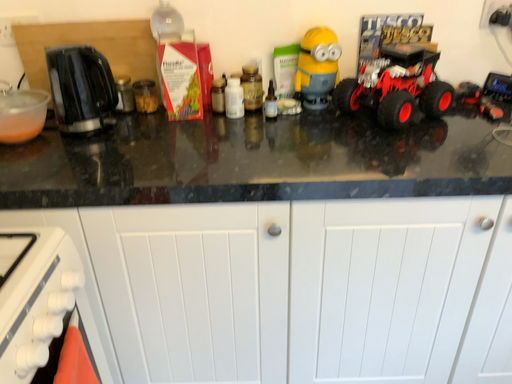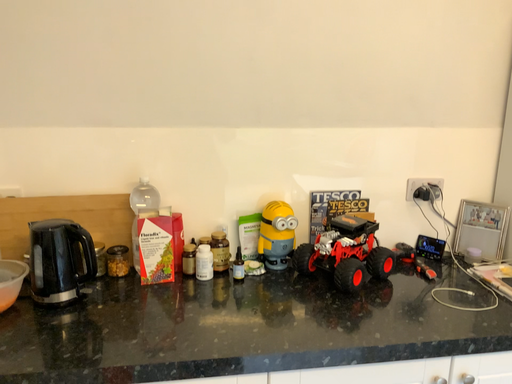
Question: Which way did the camera rotate in the video?

Choices:
 (A) rotated left
 (B) rotated right

Answer: (B)